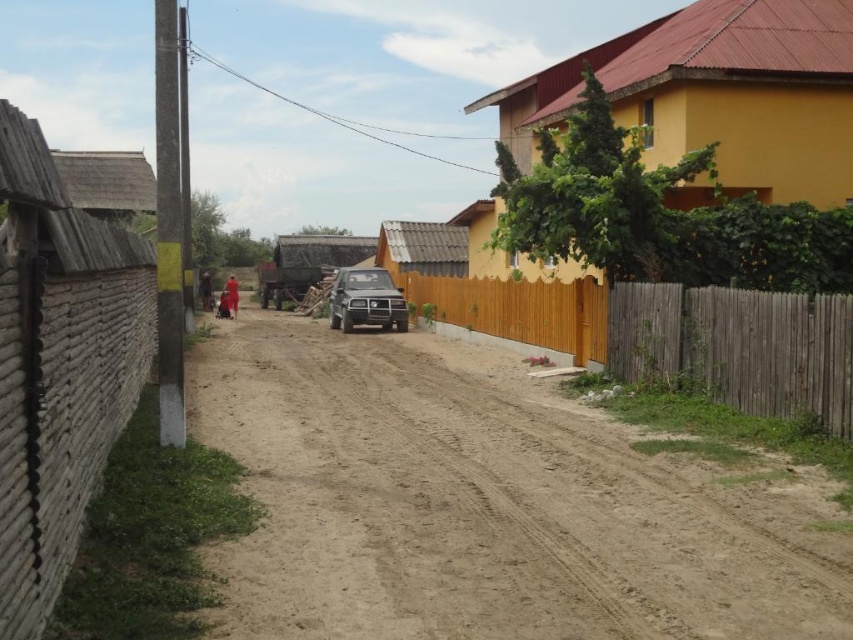
Question: Can you confirm if brown sandy dirt track at center is positioned to the right of brown wooden fence at right?

Choices:
 (A) yes
 (B) no

Answer: (B)

Question: Which point is closer to the camera?

Choices:
 (A) (682, 598)
 (B) (653, 289)

Answer: (A)

Question: Which of the following is the closest to the observer?

Choices:
 (A) (700, 387)
 (B) (368, 317)

Answer: (A)

Question: Is brown sandy dirt track at center smaller than satin black suv at center?

Choices:
 (A) no
 (B) yes

Answer: (B)

Question: Is brown sandy dirt track at center to the right of brown wooden fence at right from the viewer's perspective?

Choices:
 (A) no
 (B) yes

Answer: (A)

Question: Which of the following is the farthest from the observer?

Choices:
 (A) satin black suv at center
 (B) brown wooden fence at right

Answer: (A)